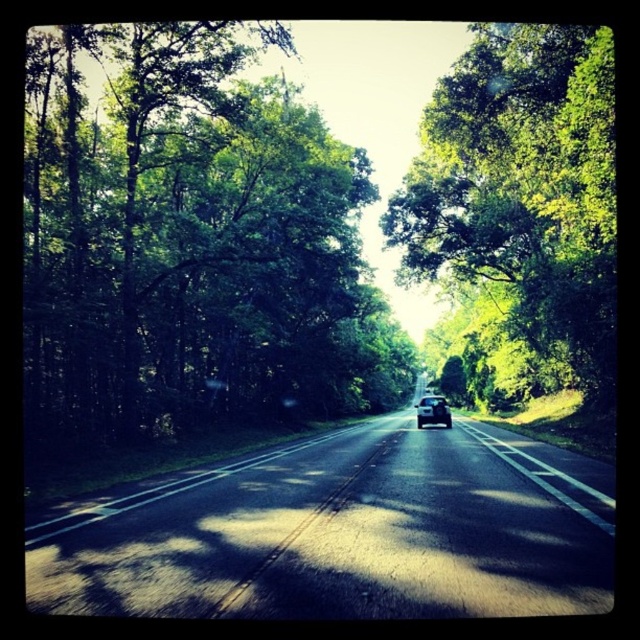
Is black asphalt road at center above green leafy tree at center?

Incorrect, black asphalt road at center is not positioned above green leafy tree at center.

Does point (224, 541) lie behind point (452, 154)?

No.

Locate an element on the screen. The image size is (640, 640). black asphalt road at center is located at coordinates (342, 532).

Is green leafy tree at center positioned at the back of shiny black car at center?

No, it is not.

Does green leafy tree at center have a smaller size compared to shiny black car at center?

Incorrect, green leafy tree at center is not smaller in size than shiny black car at center.

Locate an element on the screen. This screenshot has width=640, height=640. green leafy tree at center is located at coordinates (524, 188).

Is green leafy tree at left bigger than shiny black car at center?

Indeed, green leafy tree at left has a larger size compared to shiny black car at center.

Is green leafy tree at left smaller than shiny black car at center?

No, green leafy tree at left is not smaller than shiny black car at center.

Which is behind, point (352, 380) or point (445, 413)?

Positioned behind is point (352, 380).

I want to click on green leafy tree at left, so click(x=188, y=237).